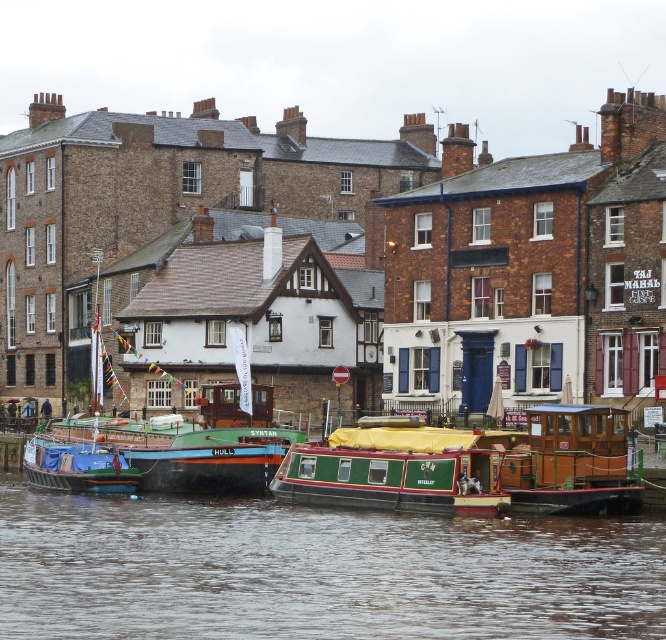
Question: Is green painted wooden boat at lower center to the left of wooden cabin cruiser at center from the viewer's perspective?

Choices:
 (A) yes
 (B) no

Answer: (A)

Question: Can you confirm if green painted wooden boat at lower center is positioned to the right of wooden cabin cruiser at center?

Choices:
 (A) yes
 (B) no

Answer: (B)

Question: Which point is farther to the camera?

Choices:
 (A) (290, 458)
 (B) (234, 557)

Answer: (A)

Question: Which of the following is the farthest from the observer?

Choices:
 (A) green painted wooden boat at lower center
 (B) wooden cabin cruiser at center
 (C) green wooden boat at center

Answer: (B)

Question: Is green painted wooden boat at lower center to the right of green wooden boat at center from the viewer's perspective?

Choices:
 (A) yes
 (B) no

Answer: (B)

Question: Among these objects, which one is farthest from the camera?

Choices:
 (A) green wooden boat at center
 (B) green painted wooden boat at lower center
 (C) wooden cabin cruiser at center

Answer: (C)